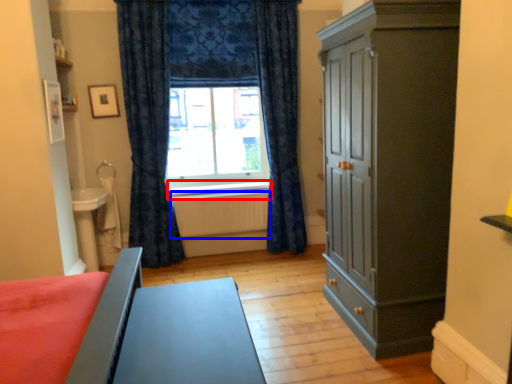
Question: Among these objects, which one is farthest to the camera, window sill (highlighted by a red box) or radiator (highlighted by a blue box)?

Choices:
 (A) window sill
 (B) radiator

Answer: (A)